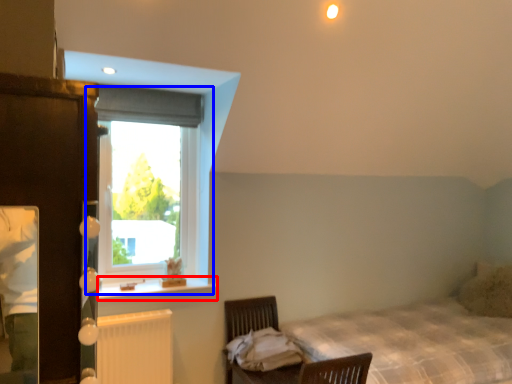
Question: Which point is further to the camera, window sill (highlighted by a red box) or window (highlighted by a blue box)?

Choices:
 (A) window sill
 (B) window

Answer: (B)